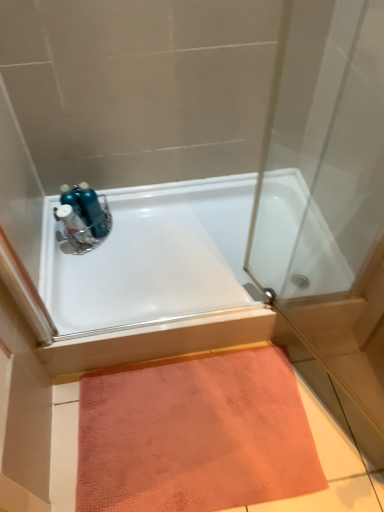
I want to click on vacant region above orange textured mat at lower center (from a real-world perspective), so click(196, 423).